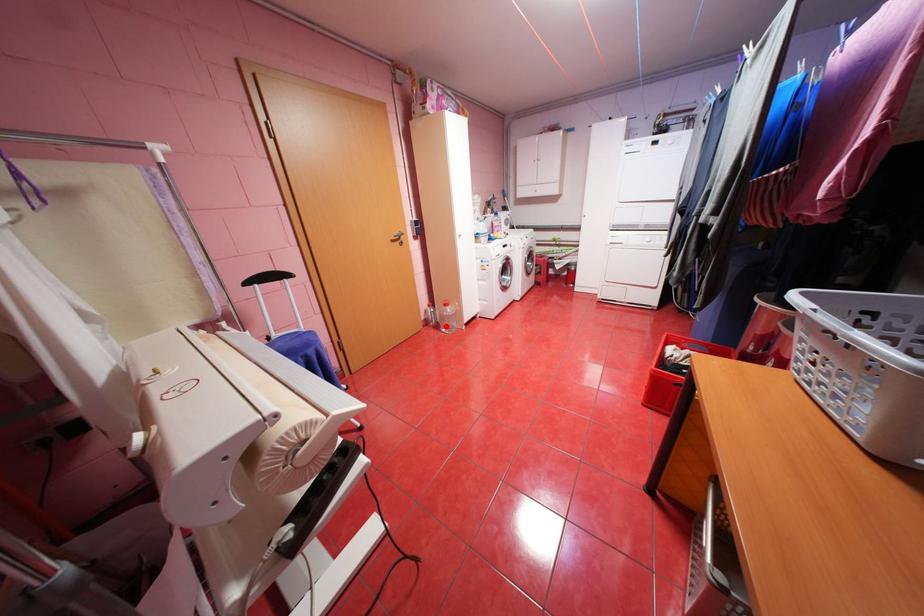
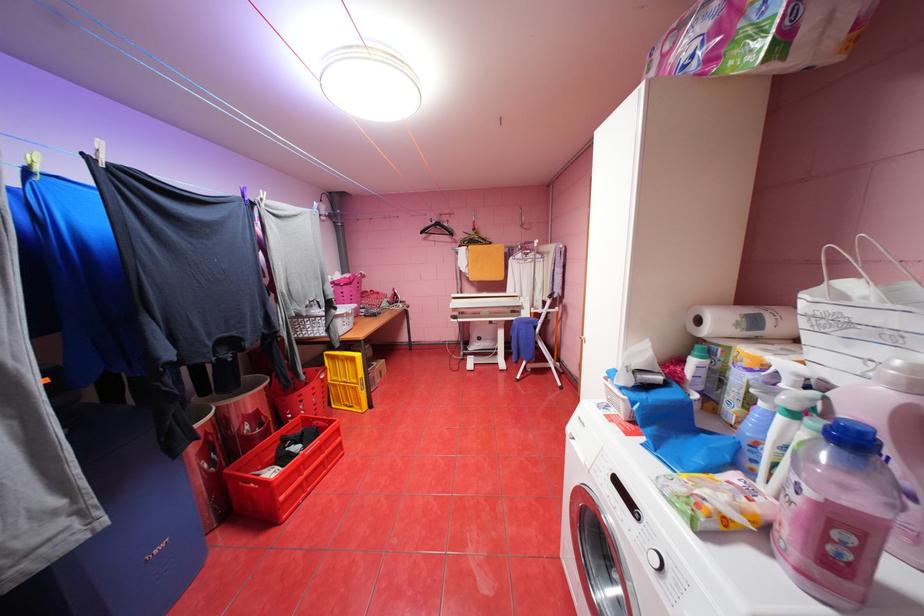
Question: I am providing you with two images of the same scene from different viewpoints. A red point is marked on the first image. Is the red point's position out of view in image 2?

Choices:
 (A) Yes
 (B) No

Answer: (A)